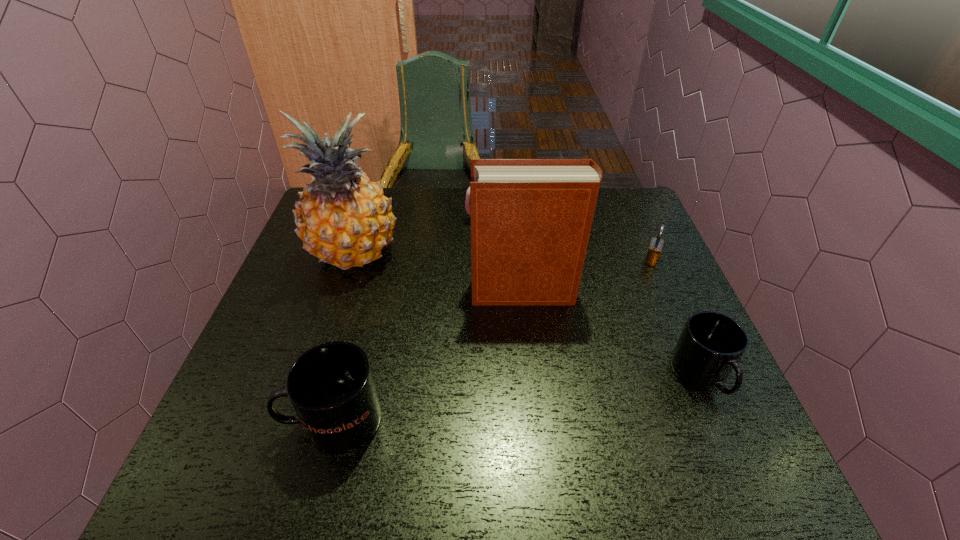
Identify the location of vacant region between the second mug from left to right and the fourth shortest object. The height and width of the screenshot is (540, 960). (414, 320).

At what (x,y) coordinates should I click in order to perform the action: click on unoccupied position between the second mug from right to left and the rightmost mug. Please return your answer as a coordinate pair (x, y). The height and width of the screenshot is (540, 960). Looking at the image, I should click on (597, 298).

Image resolution: width=960 pixels, height=540 pixels. I want to click on empty space between the second mug from left to right and the pineapple, so click(424, 238).

What are the coordinates of `vacant space in between the padlock and the second tallest object` in the screenshot? It's located at (588, 276).

You are a GUI agent. You are given a task and a screenshot of the screen. Output one action in this format:
    pyautogui.click(x=<x>, y=<y>)
    Task: Click on the vacant space that is in between the rightmost mug and the third tallest object
    The image size is (960, 540).
    Given the screenshot: What is the action you would take?
    pyautogui.click(x=517, y=398)

Point out which object is positioned as the third nearest to the rightmost mug. Please provide its 2D coordinates. Your answer should be formatted as a tuple, i.e. [(x, y)], where the tuple contains the x and y coordinates of a point satisfying the conditions above.

[(467, 206)]

Locate an element on the screen. Image resolution: width=960 pixels, height=540 pixels. object that stands as the fourth closest to the pineapple is located at coordinates (711, 345).

This screenshot has width=960, height=540. In order to click on mug that is the second closest to the rightmost mug in this screenshot , I will do `click(331, 387)`.

Find the location of a particular element. This screenshot has width=960, height=540. the second closest mug to the pineapple is located at coordinates (331, 387).